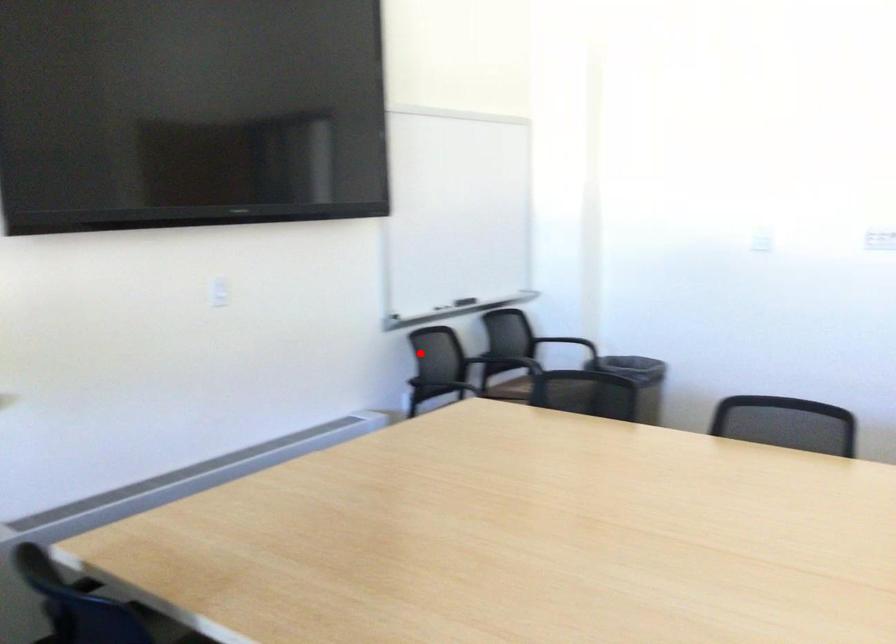
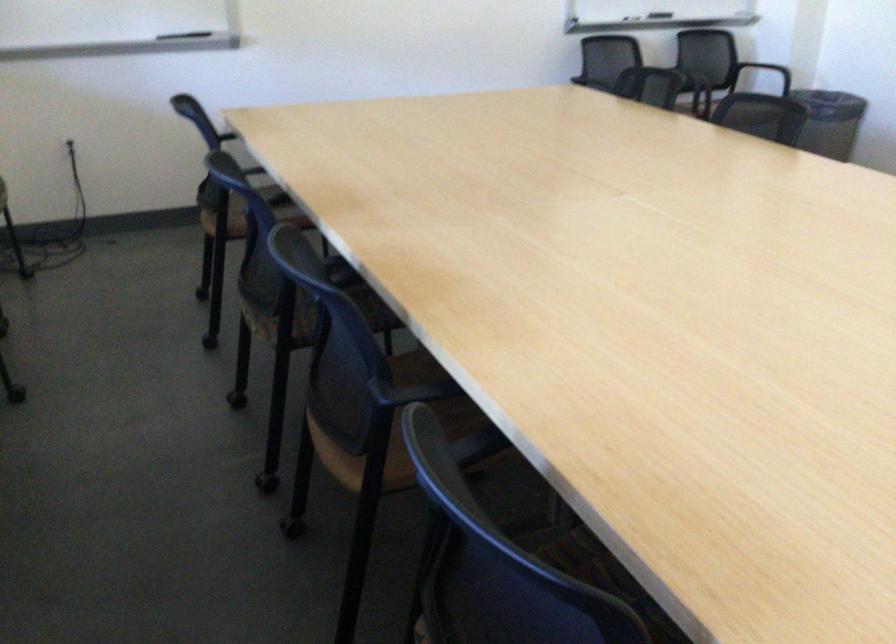
Question: I am providing you with two images of the same scene from different viewpoints. A red point is shown in image1. For the corresponding object point in image2, is it positioned nearer or farther from the camera?

Choices:
 (A) Nearer
 (B) Farther

Answer: (B)